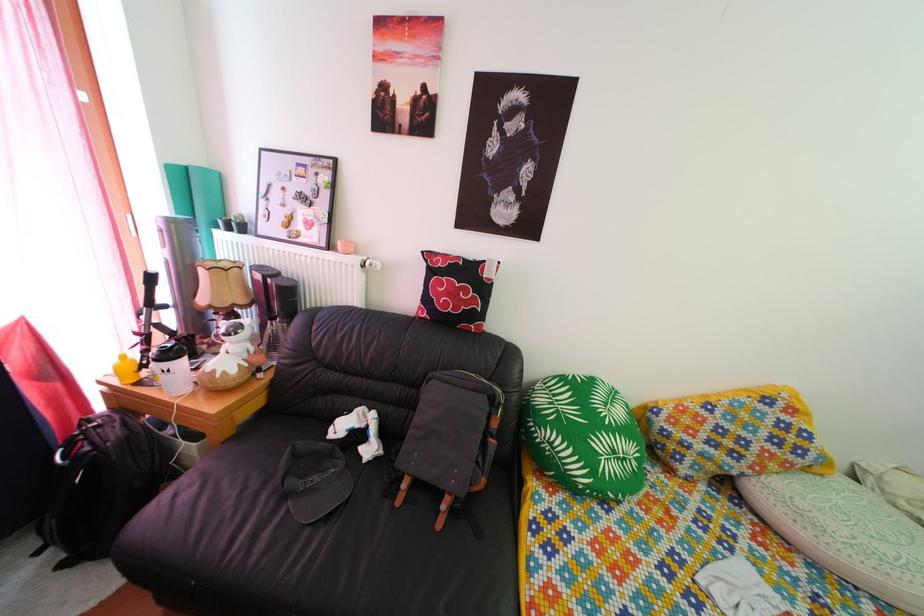
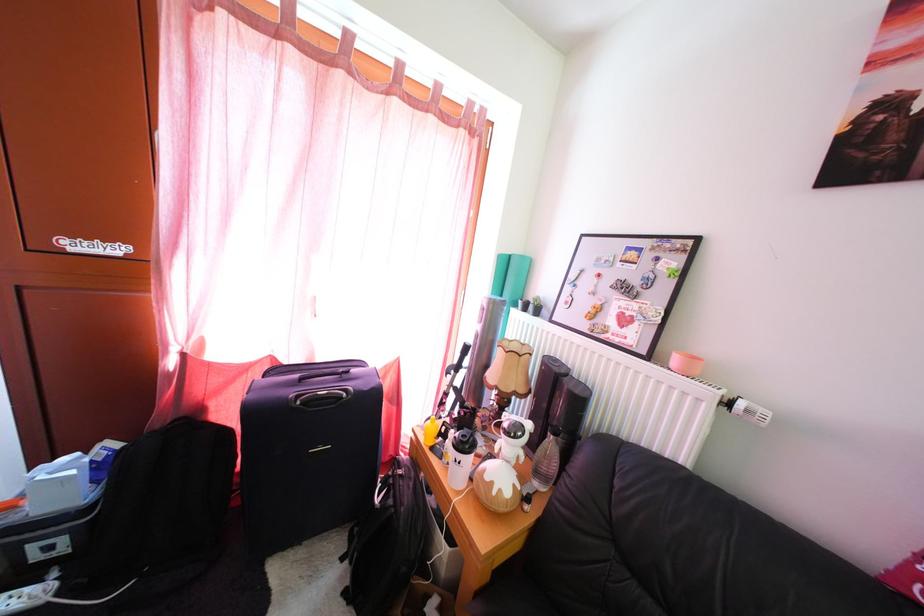
Question: The camera is either moving clockwise (left) or counter-clockwise (right) around the object. The first image is from the beginning of the video and the second image is from the end. Is the camera moving left or right when shooting the video?

Choices:
 (A) Left
 (B) Right

Answer: (B)